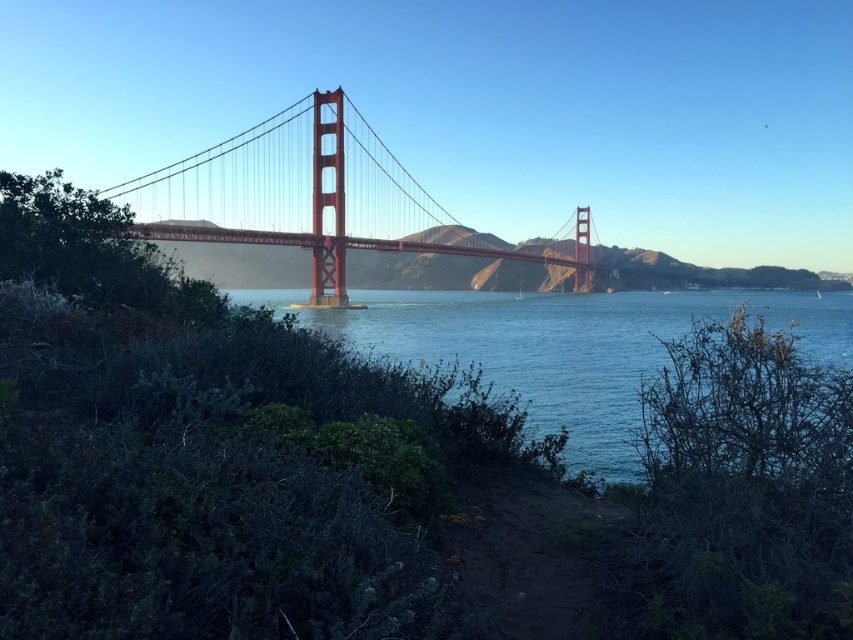
Where is `blue water at center`? blue water at center is located at coordinates (566, 346).

Between blue water at center and metallic red suspension bridge at center, which one is positioned lower?

blue water at center is lower down.

Is point (518, 344) positioned in front of point (306, 152)?

Yes, it is.

At what (x,y) coordinates should I click in order to perform the action: click on blue water at center. Please return your answer as a coordinate pair (x, y). Looking at the image, I should click on (566, 346).